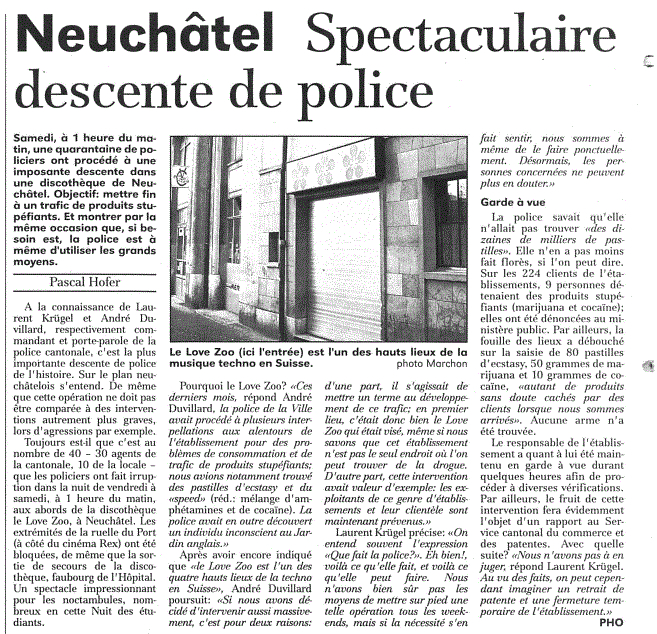
This screenshot has height=634, width=657. What are the coordinates of `windows` in the screenshot? It's located at (449, 230), (237, 222), (236, 151), (179, 250).